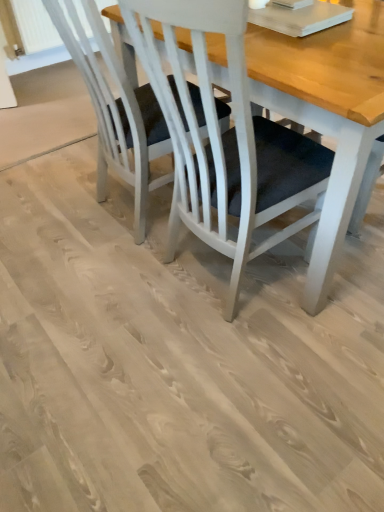
Question: Does white painted wood chair at center have a lesser height compared to wooden table at center?

Choices:
 (A) yes
 (B) no

Answer: (A)

Question: Is white painted wood chair at center located outside wooden table at center?

Choices:
 (A) yes
 (B) no

Answer: (A)

Question: From a real-world perspective, is white painted wood chair at center positioned under wooden table at center based on gravity?

Choices:
 (A) yes
 (B) no

Answer: (A)

Question: Considering the relative positions of white painted wood chair at center and wooden table at center in the image provided, is white painted wood chair at center to the right of wooden table at center from the viewer's perspective?

Choices:
 (A) no
 (B) yes

Answer: (A)

Question: Is white painted wood chair at center turned away from wooden table at center?

Choices:
 (A) yes
 (B) no

Answer: (B)

Question: From a real-world perspective, is white painted wood chair at center located higher than wooden table at center?

Choices:
 (A) yes
 (B) no

Answer: (B)

Question: From the image's perspective, would you say wooden table at center is positioned over white painted wood chair at center?

Choices:
 (A) yes
 (B) no

Answer: (B)

Question: Is wooden table at center located outside white painted wood chair at center?

Choices:
 (A) yes
 (B) no

Answer: (A)

Question: Does wooden table at center have a greater width compared to white painted wood chair at center?

Choices:
 (A) no
 (B) yes

Answer: (A)

Question: Considering the relative sizes of wooden table at center and white painted wood chair at center in the image provided, is wooden table at center thinner than white painted wood chair at center?

Choices:
 (A) yes
 (B) no

Answer: (A)

Question: Is wooden table at center further to camera compared to white painted wood chair at center?

Choices:
 (A) yes
 (B) no

Answer: (B)

Question: From a real-world perspective, does wooden table at center sit lower than white painted wood chair at center?

Choices:
 (A) no
 (B) yes

Answer: (A)

Question: From the image's perspective, relative to wooden table at center, is white painted wood chair at center above or below?

Choices:
 (A) below
 (B) above

Answer: (B)